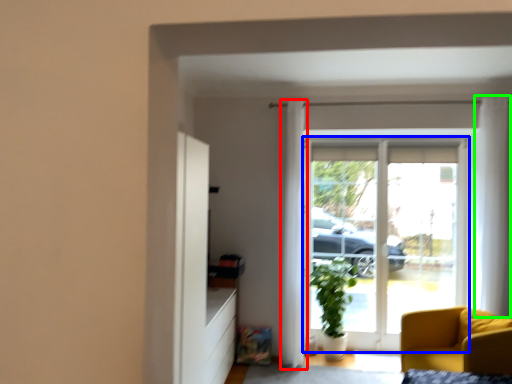
Question: Considering the real-world distances, which object is farthest from curtain (highlighted by a red box)? door (highlighted by a blue box) or curtain (highlighted by a green box)?

Choices:
 (A) door
 (B) curtain

Answer: (B)